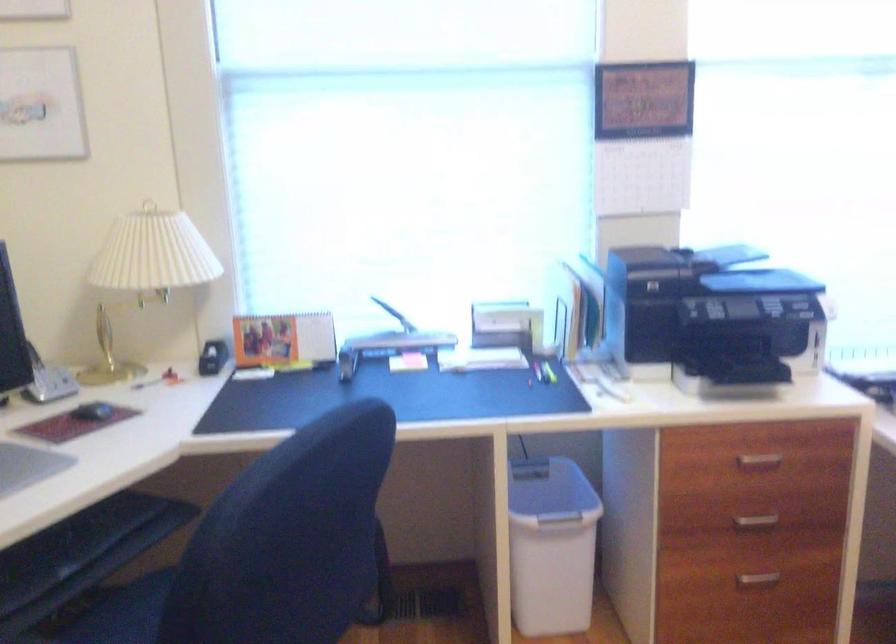
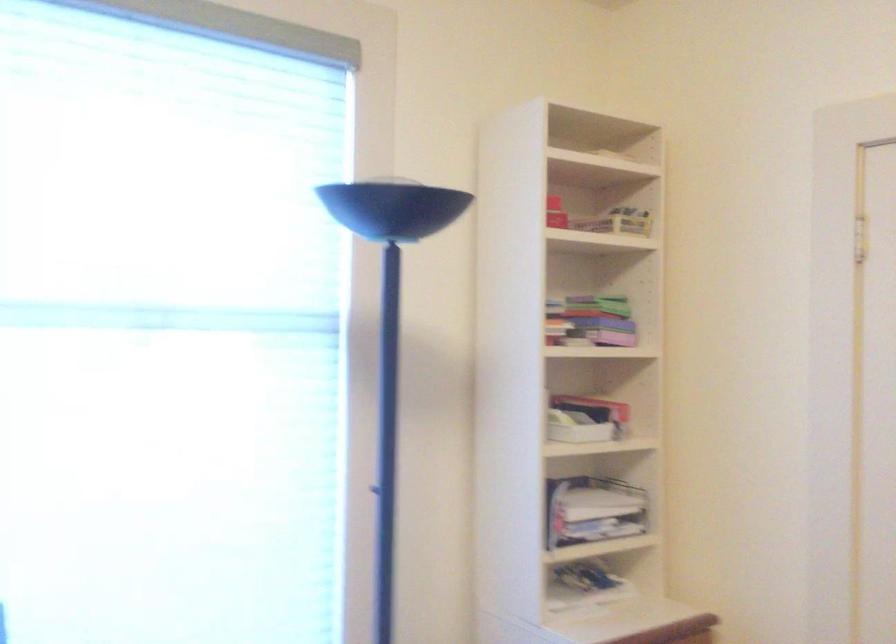
Question: The camera is either moving clockwise (left) or counter-clockwise (right) around the object. The first image is from the beginning of the video and the second image is from the end. Is the camera moving left or right when shooting the video?

Choices:
 (A) Left
 (B) Right

Answer: (A)